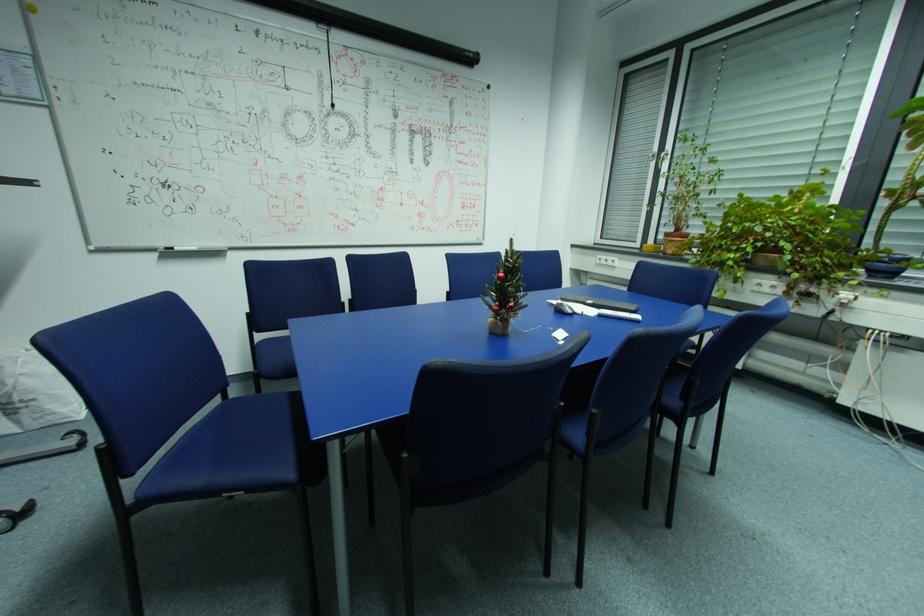
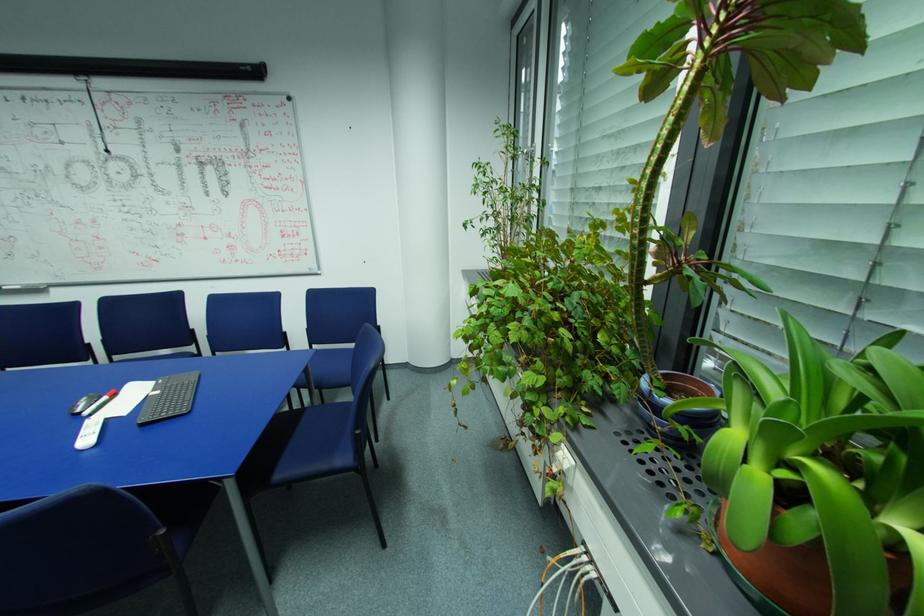
What movement of the cameraman would produce the second image?

The cameraman walked toward right, forward.